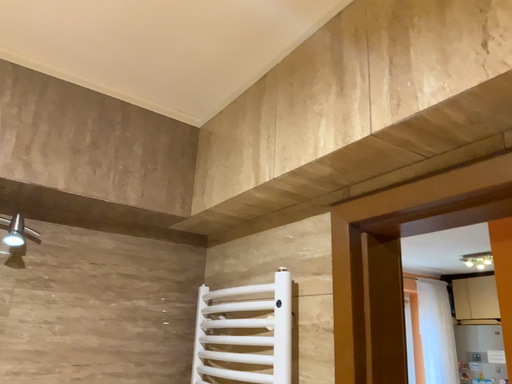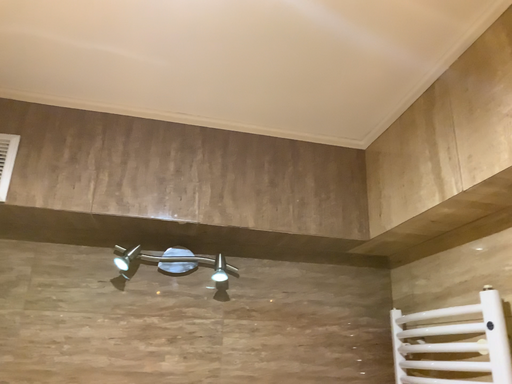
Question: Which way did the camera rotate in the video?

Choices:
 (A) rotated left
 (B) rotated right

Answer: (A)